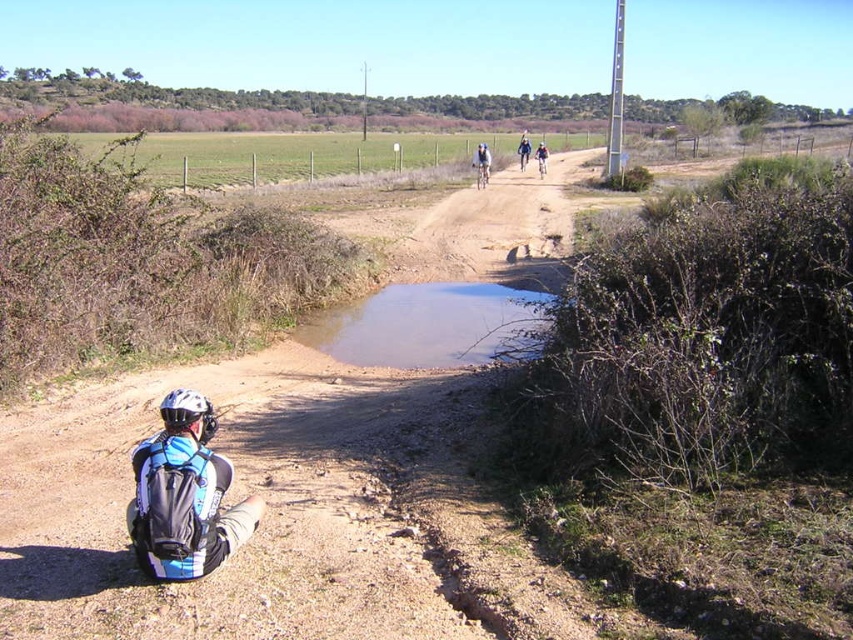
Is blue matte dirt bike at center wider than blue fabric jacket at upper center?

In fact, blue matte dirt bike at center might be narrower than blue fabric jacket at upper center.

Image resolution: width=853 pixels, height=640 pixels. Describe the element at coordinates (480, 172) in the screenshot. I see `blue matte dirt bike at center` at that location.

Locate an element on the screen. blue matte dirt bike at center is located at coordinates (480, 172).

Which is behind, point (424, 346) or point (531, 150)?

Point (531, 150)

Is brown muddy puddle at center taller than blue fabric jacket at upper center?

Incorrect, brown muddy puddle at center's height is not larger of blue fabric jacket at upper center's.

The height and width of the screenshot is (640, 853). What are the coordinates of `brown muddy puddle at center` in the screenshot? It's located at (425, 324).

Which is behind, point (206, 512) or point (520, 164)?

The point (520, 164) is behind.

Identify the location of blue fabric backpack at lower left. This screenshot has height=640, width=853. pos(184,496).